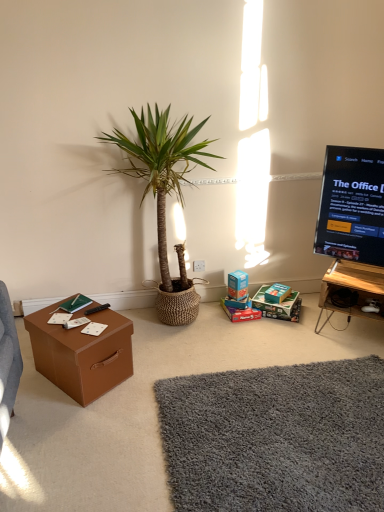
Find the location of a particular element. This screenshot has height=512, width=384. free space above brown cardboard box at lower left, the first plain when ordered from front to back (from a real-world perspective) is located at coordinates point(235,404).